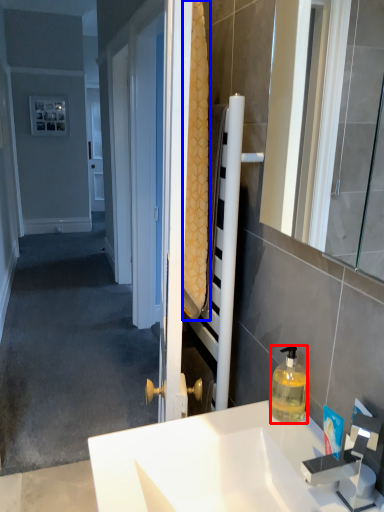
Question: Which of the following is the closest to the observer, bottle (highlighted by a red box) or bath towel (highlighted by a blue box)?

Choices:
 (A) bottle
 (B) bath towel

Answer: (B)